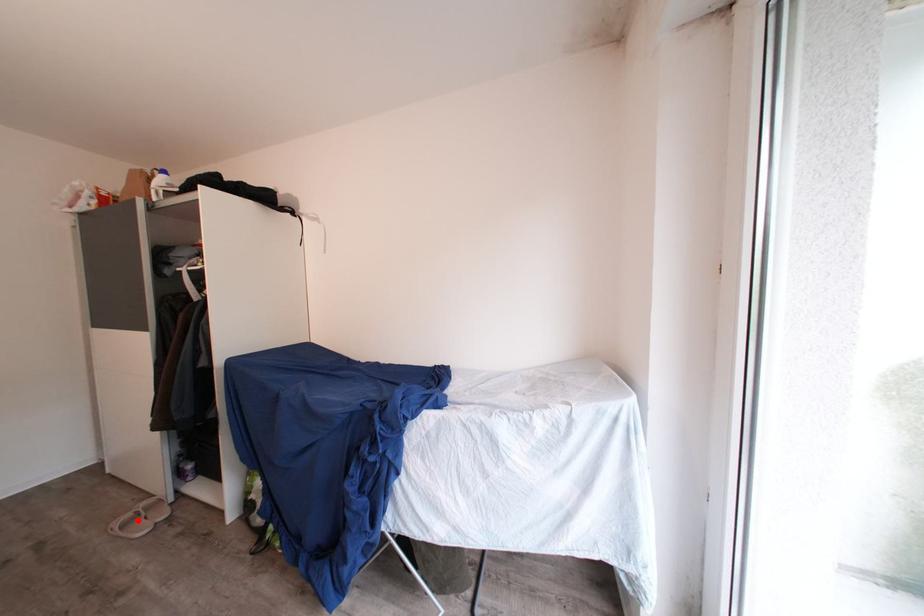
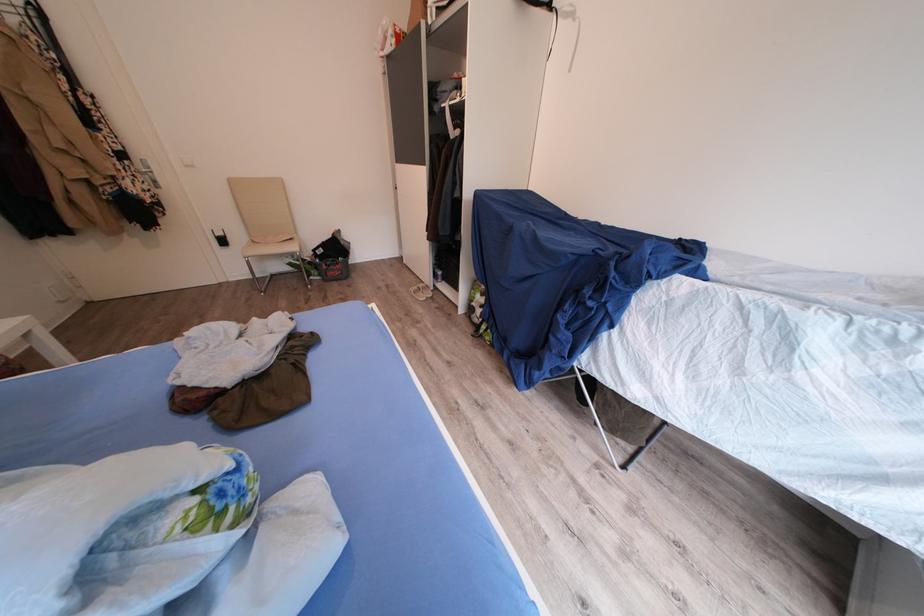
Where in the second image is the point corresponding to the highlighted location from the first image?

(424, 293)